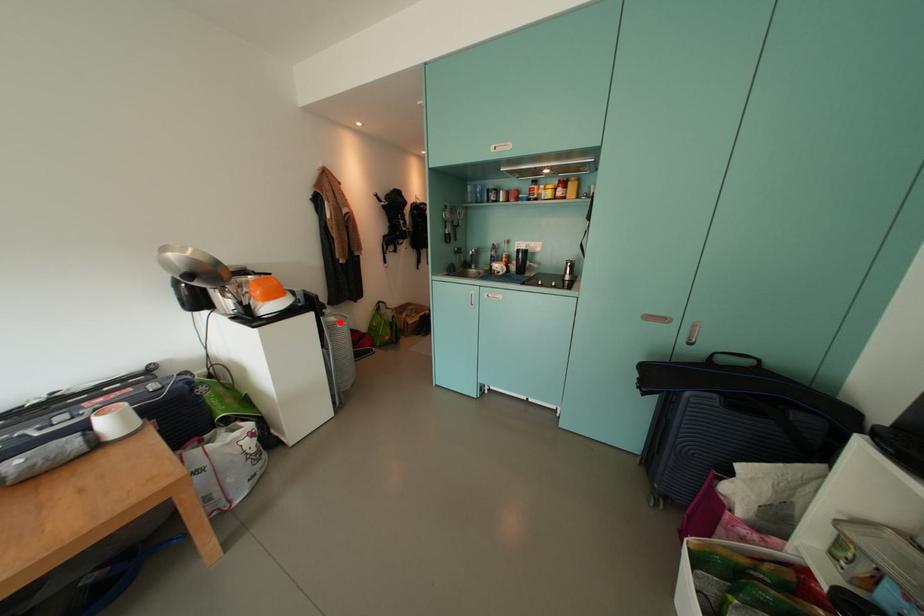
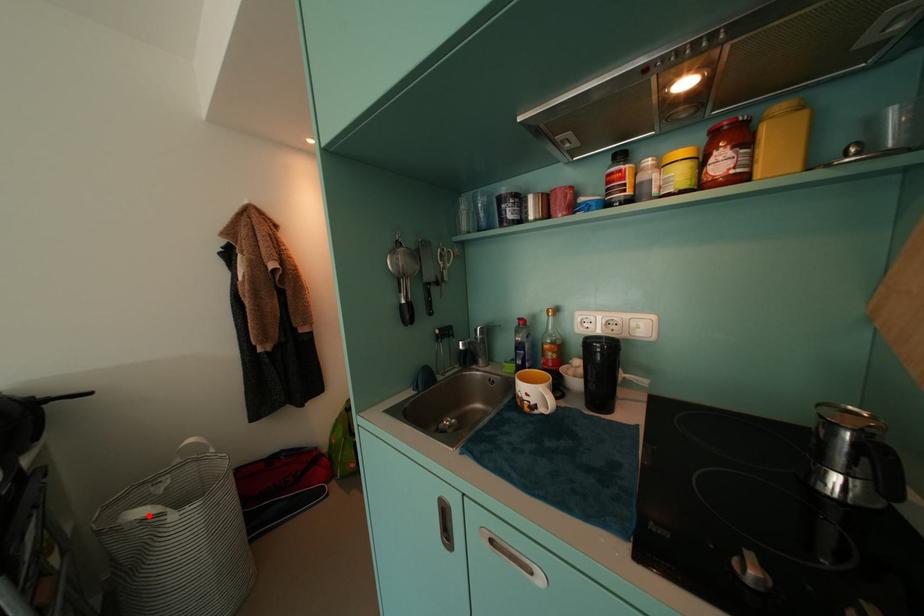
I am providing you with two images of the same scene from different viewpoints. A red point is marked on the first image and another point is marked on the second image. Is the marked point in image1 the same physical position as the marked point in image2?

Yes